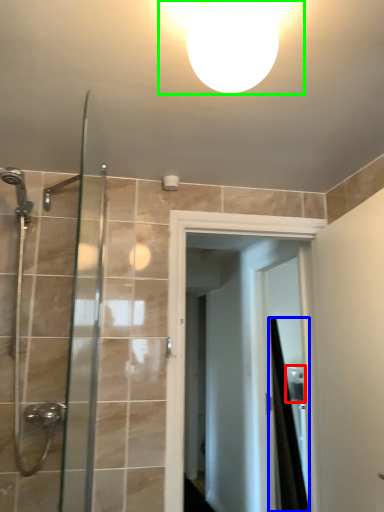
Question: Which object is positioned farthest from sink (highlighted by a red box)? Select from shower curtain (highlighted by a blue box) and light fixture (highlighted by a green box).

Choices:
 (A) shower curtain
 (B) light fixture

Answer: (B)